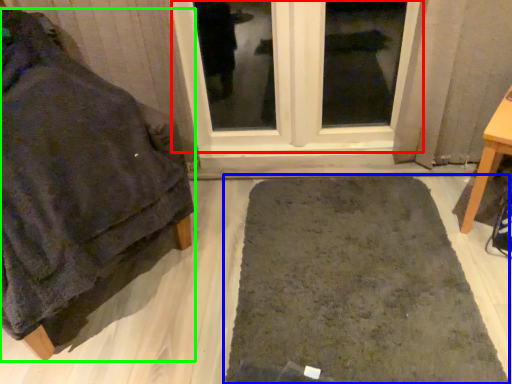
Question: Which is nearer to the window (highlighted by a red box)? bath mat (highlighted by a blue box) or furniture (highlighted by a green box).

Choices:
 (A) bath mat
 (B) furniture

Answer: (A)